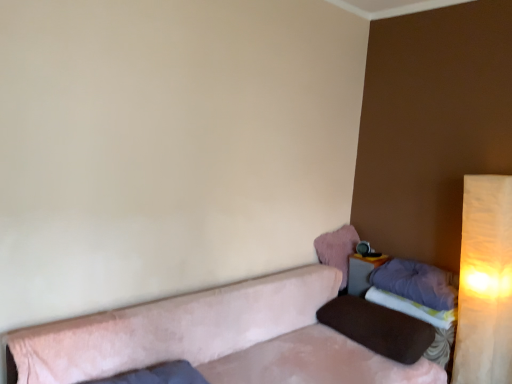
What do you see at coordinates (216, 338) in the screenshot? I see `suede-like beige couch at lower right` at bounding box center [216, 338].

Find the location of `pink fluffy pillow at upper right, arranged as the third pillow when ordered from the bottom`. pink fluffy pillow at upper right, arranged as the third pillow when ordered from the bottom is located at coordinates (337, 249).

Image resolution: width=512 pixels, height=384 pixels. Find the location of `purple fabric sheet at lower right`. purple fabric sheet at lower right is located at coordinates (411, 308).

This screenshot has width=512, height=384. I want to click on purple soft pillow at right, the 2th pillow from the top, so click(x=416, y=283).

You are a GUI agent. You are given a task and a screenshot of the screen. Output one action in this format:
    pyautogui.click(x=<x>, y=<y>)
    Task: Click on the matte gray table at lower right
    The height and width of the screenshot is (384, 512).
    Given the screenshot: What is the action you would take?
    pyautogui.click(x=362, y=272)

The width and height of the screenshot is (512, 384). Find the location of `brown fabric pillow at right, arranged as the first pillow when ordered from the bottom`. brown fabric pillow at right, arranged as the first pillow when ordered from the bottom is located at coordinates (378, 328).

Locate an element on the screen. The height and width of the screenshot is (384, 512). suede-like beige couch at lower right is located at coordinates (216, 338).

Can you confirm if purple fabric sheet at lower right is positioned to the left of brown fabric pillow at right, which appears as the third pillow when viewed from the top?

No.

Is purple fabric sheet at lower right facing towards brown fabric pillow at right, which appears as the third pillow when viewed from the top?

Yes.

Would you say purple fabric sheet at lower right is outside brown fabric pillow at right, which appears as the third pillow when viewed from the top?

Yes, purple fabric sheet at lower right is located beyond the bounds of brown fabric pillow at right, which appears as the third pillow when viewed from the top.

Is purple fabric sheet at lower right with brown fabric pillow at right, arranged as the first pillow when ordered from the bottom?

No, purple fabric sheet at lower right is not next to brown fabric pillow at right, arranged as the first pillow when ordered from the bottom.

From the picture: Measure the distance from matte gray table at lower right to purple soft pillow at right, arranged as the second pillow when ordered from the bottom.

They are 9.36 inches apart.

Which of these two, matte gray table at lower right or purple soft pillow at right, the 2th pillow from the top, stands taller?

matte gray table at lower right.

From the image's perspective, relative to purple soft pillow at right, the 2th pillow from the top, is matte gray table at lower right above or below?

From the image's perspective, matte gray table at lower right appears below purple soft pillow at right, the 2th pillow from the top.

Can purple soft pillow at right, arranged as the second pillow when ordered from the bottom, be found inside matte gray table at lower right?

Definitely not — purple soft pillow at right, arranged as the second pillow when ordered from the bottom, is not inside matte gray table at lower right.

Is warm beige fabric lampshade at right oriented towards pink fluffy pillow at upper right, which is the first pillow in top-to-bottom order?

No, warm beige fabric lampshade at right is not facing towards pink fluffy pillow at upper right, which is the first pillow in top-to-bottom order.

From the image's perspective, would you say warm beige fabric lampshade at right is positioned over pink fluffy pillow at upper right, arranged as the third pillow when ordered from the bottom?

No, from the image's perspective, warm beige fabric lampshade at right is not on top of pink fluffy pillow at upper right, arranged as the third pillow when ordered from the bottom.

From a real-world perspective, which is physically above, warm beige fabric lampshade at right or pink fluffy pillow at upper right, arranged as the third pillow when ordered from the bottom?

In real-world perspective, pink fluffy pillow at upper right, arranged as the third pillow when ordered from the bottom, is above.

Is pink fluffy pillow at upper right, arranged as the third pillow when ordered from the bottom, located within warm beige fabric lampshade at right?

That's incorrect, pink fluffy pillow at upper right, arranged as the third pillow when ordered from the bottom, is not inside warm beige fabric lampshade at right.

Considering the sizes of purple fabric sheet at lower right and pink fluffy pillow at upper right, arranged as the third pillow when ordered from the bottom, in the image, is purple fabric sheet at lower right wider or thinner than pink fluffy pillow at upper right, arranged as the third pillow when ordered from the bottom,?

In the image, purple fabric sheet at lower right appears to be wider than pink fluffy pillow at upper right, arranged as the third pillow when ordered from the bottom.

Does purple fabric sheet at lower right lie in front of pink fluffy pillow at upper right, which is the first pillow in top-to-bottom order?

Yes, purple fabric sheet at lower right is closer to the camera.

From a real-world perspective, count 2nd pillows upward from the purple fabric sheet at lower right and point to it. Please provide its 2D coordinates.

[(337, 249)]

From the picture: Between purple fabric sheet at lower right and pink fluffy pillow at upper right, arranged as the third pillow when ordered from the bottom, which one has smaller size?

Smaller between the two is pink fluffy pillow at upper right, arranged as the third pillow when ordered from the bottom.

Which is farther, [154,357] or [415,306]?

The point [415,306] is farther.

Is suede-like beige couch at lower right completely or partially outside of purple fabric sheet at lower right?

suede-like beige couch at lower right is positioned outside purple fabric sheet at lower right.

Could you tell me if suede-like beige couch at lower right is facing purple fabric sheet at lower right?

No, suede-like beige couch at lower right is not facing towards purple fabric sheet at lower right.

Between suede-like beige couch at lower right and purple fabric sheet at lower right, which one appears on the right side from the viewer's perspective?

purple fabric sheet at lower right.

Does suede-like beige couch at lower right come in front of matte gray table at lower right?

Yes, suede-like beige couch at lower right is in front of matte gray table at lower right.

Is suede-like beige couch at lower right positioned far away from matte gray table at lower right?

They are positioned close to each other.

Is point (9, 339) farther from viewer compared to point (352, 267)?

No, (9, 339) is in front of (352, 267).

Is suede-like beige couch at lower right positioned with its back to matte gray table at lower right?

That's not correct — suede-like beige couch at lower right is not looking away from matte gray table at lower right.

From a real-world perspective, is purple fabric sheet at lower right below purple soft pillow at right, the 2th pillow from the top?

Yes, from a real-world perspective, purple fabric sheet at lower right is under purple soft pillow at right, the 2th pillow from the top.

Where is `sheet below the purple soft pillow at right, the 2th pillow from the top (from a real-world perspective)`? This screenshot has height=384, width=512. sheet below the purple soft pillow at right, the 2th pillow from the top (from a real-world perspective) is located at coordinates (411, 308).

What's the angular difference between purple fabric sheet at lower right and purple soft pillow at right, arranged as the second pillow when ordered from the bottom,'s facing directions?

They differ by 0.000132 degrees in their facing directions.

Considering the relative sizes of purple fabric sheet at lower right and purple soft pillow at right, arranged as the second pillow when ordered from the bottom, in the image provided, is purple fabric sheet at lower right taller than purple soft pillow at right, arranged as the second pillow when ordered from the bottom,?

No.

Image resolution: width=512 pixels, height=384 pixels. Find the location of `sheet above the brown fabric pillow at right, arranged as the first pillow when ordered from the bottom (from a real-world perspective)`. sheet above the brown fabric pillow at right, arranged as the first pillow when ordered from the bottom (from a real-world perspective) is located at coordinates (411, 308).

From the image's perspective, count 1st pillows upward from the matte gray table at lower right and point to it. Please provide its 2D coordinates.

[(416, 283)]

Looking at the image, which one is located further to brown fabric pillow at right, which appears as the third pillow when viewed from the top, purple fabric sheet at lower right or pink fluffy pillow at upper right, which is the first pillow in top-to-bottom order?

pink fluffy pillow at upper right, which is the first pillow in top-to-bottom order, is further to brown fabric pillow at right, which appears as the third pillow when viewed from the top.

Consider the image. Looking at the image, which one is located further to warm beige fabric lampshade at right, purple fabric sheet at lower right or matte gray table at lower right?

matte gray table at lower right.

From the image, which object appears to be farther from purple soft pillow at right, arranged as the second pillow when ordered from the bottom, purple fabric sheet at lower right or matte gray table at lower right?

matte gray table at lower right lies further to purple soft pillow at right, arranged as the second pillow when ordered from the bottom, than the other object.

From the image, which object appears to be nearer to matte gray table at lower right, pink fluffy pillow at upper right, arranged as the third pillow when ordered from the bottom, or purple fabric sheet at lower right?

Based on the image, pink fluffy pillow at upper right, arranged as the third pillow when ordered from the bottom, appears to be nearer to matte gray table at lower right.

Considering their positions, is brown fabric pillow at right, arranged as the first pillow when ordered from the bottom, positioned closer to purple fabric sheet at lower right than suede-like beige couch at lower right?

brown fabric pillow at right, arranged as the first pillow when ordered from the bottom, lies closer to purple fabric sheet at lower right than the other object.

Considering their positions, is matte gray table at lower right positioned closer to warm beige fabric lampshade at right than purple fabric sheet at lower right?

purple fabric sheet at lower right is positioned closer to the anchor warm beige fabric lampshade at right.

Estimate the real-world distances between objects in this image. Which object is further from pink fluffy pillow at upper right, which is the first pillow in top-to-bottom order, brown fabric pillow at right, which appears as the third pillow when viewed from the top, or purple soft pillow at right, the 2th pillow from the top?

Based on the image, brown fabric pillow at right, which appears as the third pillow when viewed from the top, appears to be further to pink fluffy pillow at upper right, which is the first pillow in top-to-bottom order.

Based on their spatial positions, is warm beige fabric lampshade at right or brown fabric pillow at right, which appears as the third pillow when viewed from the top, further from purple soft pillow at right, the 2th pillow from the top?

warm beige fabric lampshade at right.

Locate an element on the screen. This screenshot has height=384, width=512. pillow between brown fabric pillow at right, which appears as the third pillow when viewed from the top, and matte gray table at lower right in the front-back direction is located at coordinates (416, 283).

You are a GUI agent. You are given a task and a screenshot of the screen. Output one action in this format:
    pyautogui.click(x=<x>, y=<y>)
    Task: Click on the pillow located between brown fabric pillow at right, arranged as the first pillow when ordered from the bottom, and pink fluffy pillow at upper right, arranged as the third pillow when ordered from the bottom, in the depth direction
    The height and width of the screenshot is (384, 512).
    Given the screenshot: What is the action you would take?
    pyautogui.click(x=416, y=283)

You are a GUI agent. You are given a task and a screenshot of the screen. Output one action in this format:
    pyautogui.click(x=<x>, y=<y>)
    Task: Click on the table located between suede-like beige couch at lower right and pink fluffy pillow at upper right, arranged as the third pillow when ordered from the bottom, in the depth direction
    The width and height of the screenshot is (512, 384).
    Given the screenshot: What is the action you would take?
    pyautogui.click(x=362, y=272)

Locate an element on the screen. This screenshot has height=384, width=512. table located between warm beige fabric lampshade at right and pink fluffy pillow at upper right, which is the first pillow in top-to-bottom order, in the depth direction is located at coordinates (362, 272).